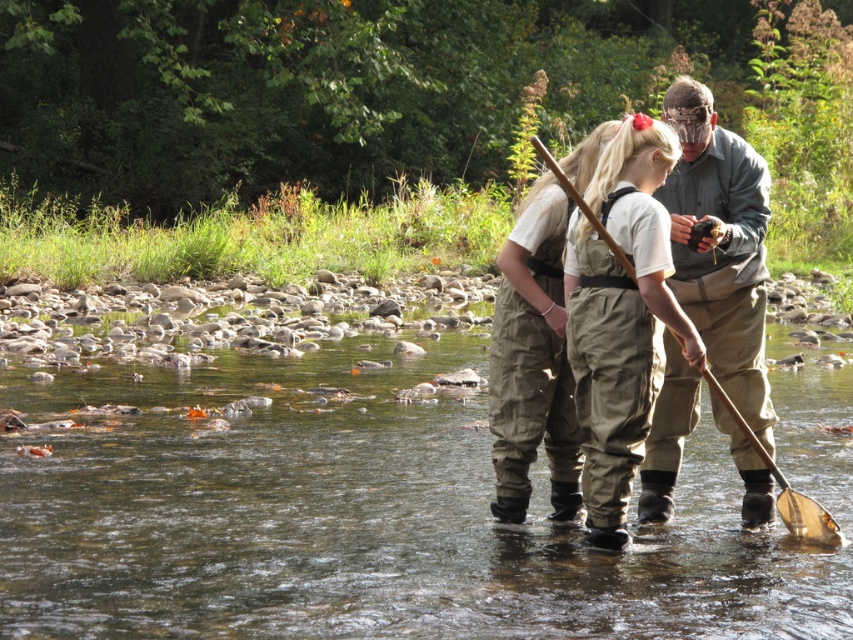
Question: Which point is farther to the camera?

Choices:
 (A) camouflage-patterned waders at center
 (B) wooden paddle at center

Answer: (B)

Question: Can you confirm if camouflage-patterned waders at center is thinner than wooden paddle at center?

Choices:
 (A) yes
 (B) no

Answer: (B)

Question: Is clear water at river center wider than camouflage-patterned waders at center?

Choices:
 (A) no
 (B) yes

Answer: (B)

Question: Which object is closer to the camera taking this photo?

Choices:
 (A) wooden paddle at center
 (B) clear water at river center

Answer: (B)

Question: Where is clear water at river center located in relation to camouflage-patterned waders at center in the image?

Choices:
 (A) above
 (B) below

Answer: (B)

Question: Which of these objects is positioned closest to the wooden paddle at center?

Choices:
 (A) camouflage-patterned waders at center
 (B) clear water at river center

Answer: (A)